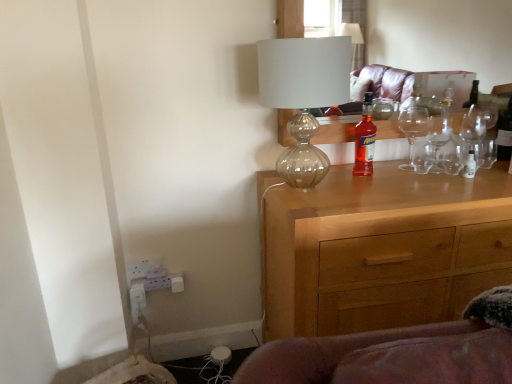
The width and height of the screenshot is (512, 384). I want to click on free space underneath transparent glass lampshade at upper center (from a real-world perspective), so click(307, 190).